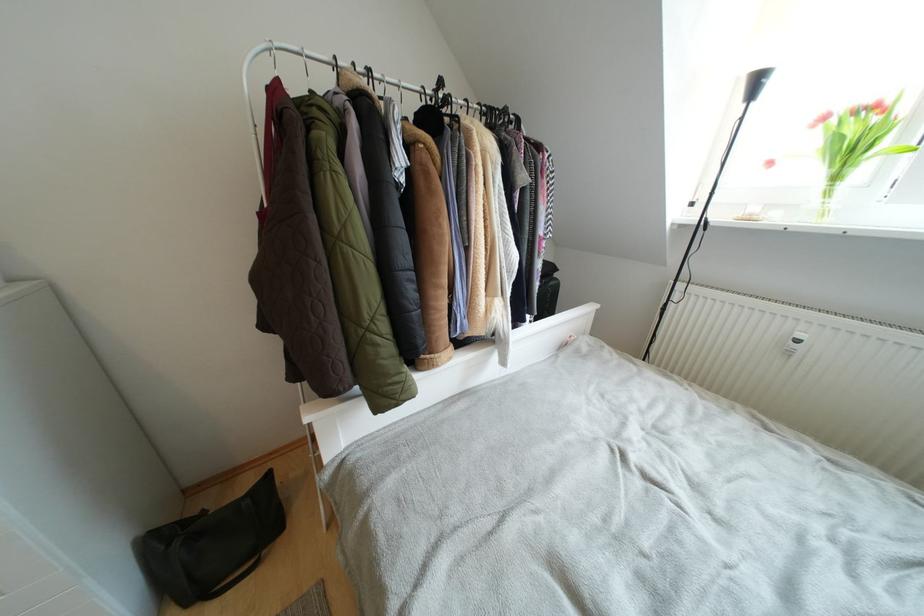
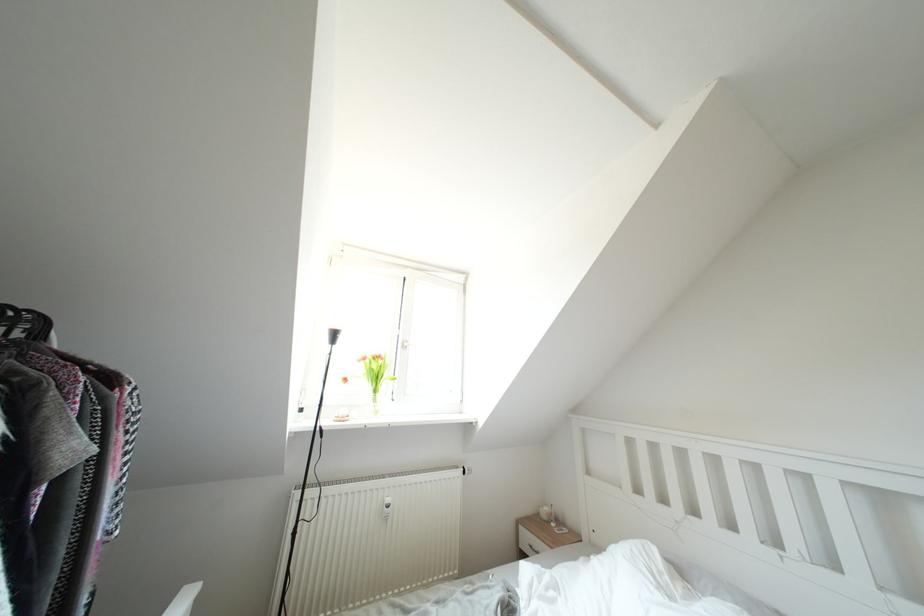
Find the pixel in the second image that matches (x=830, y=122) in the first image.

(370, 363)